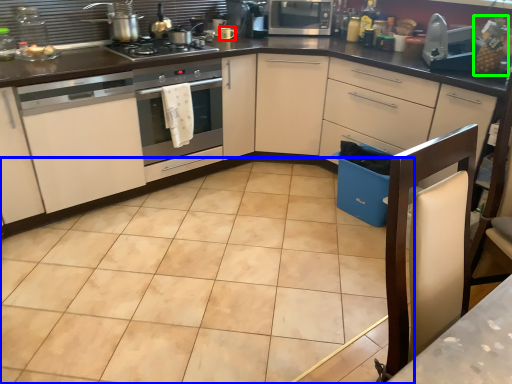
Question: Based on their relative distances, which object is nearer to appliance (highlighted by a red box)? Choose from ceramic tile (highlighted by a blue box) and fruit (highlighted by a green box).

Choices:
 (A) ceramic tile
 (B) fruit

Answer: (B)